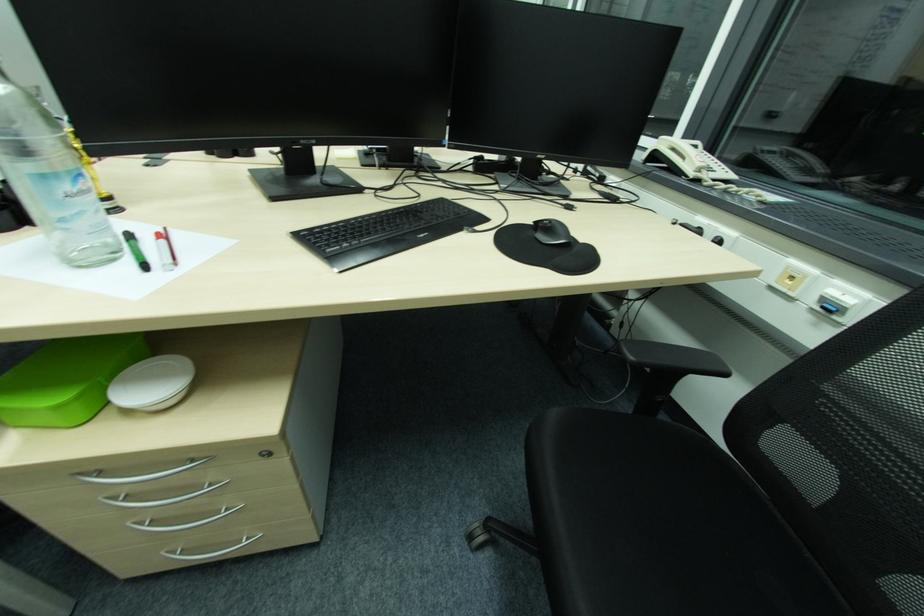
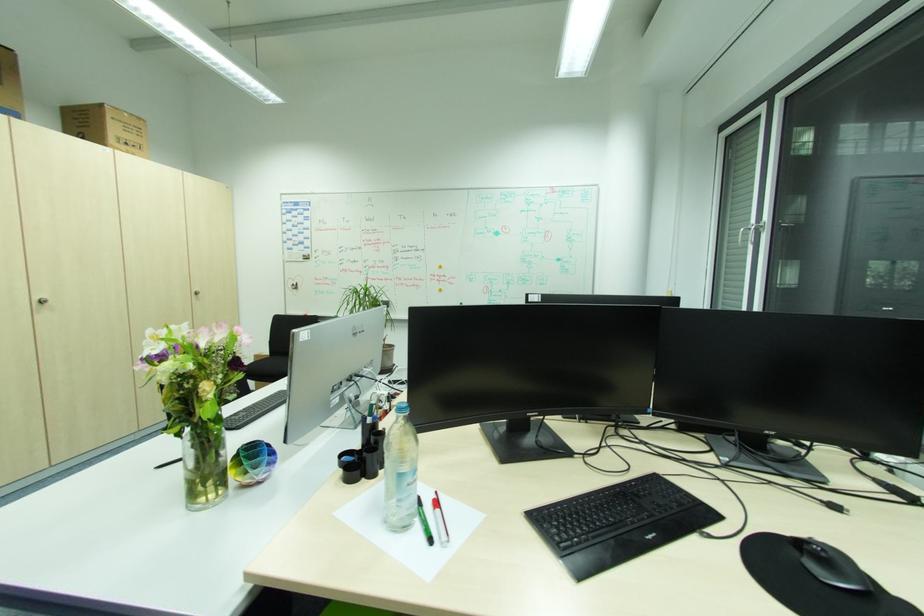
Locate, in the second image, the point that corresponds to (x=431, y=233) in the first image.

(660, 533)